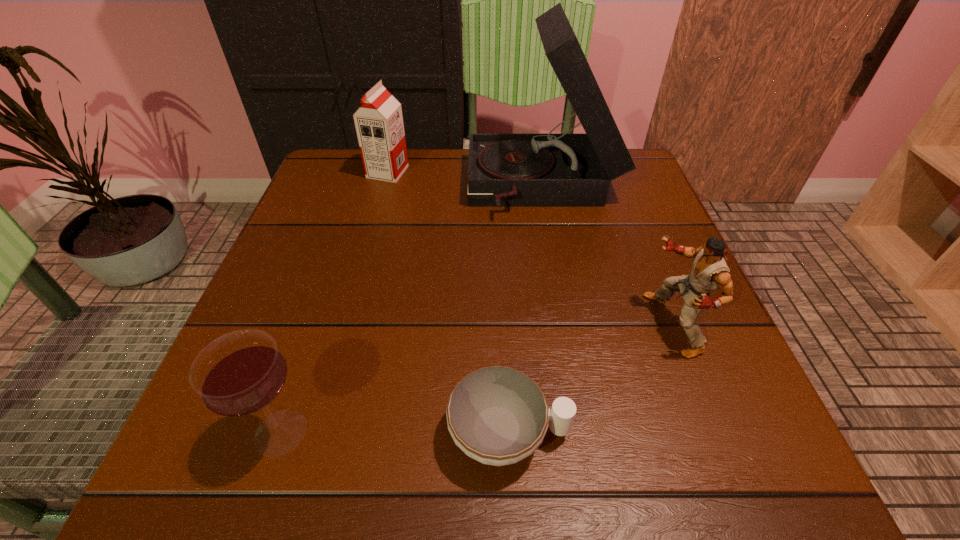
Identify the location of vacant space that is in between the tallest object and the wineglass. (412, 310).

Locate which object ranks second in proximity to the third nearest object. Please provide its 2D coordinates. Your answer should be formatted as a tuple, i.e. [(x, y)], where the tuple contains the x and y coordinates of a point satisfying the conditions above.

[(505, 170)]

Identify which object is located as the third nearest to the wineglass. Please provide its 2D coordinates. Your answer should be formatted as a tuple, i.e. [(x, y)], where the tuple contains the x and y coordinates of a point satisfying the conditions above.

[(710, 272)]